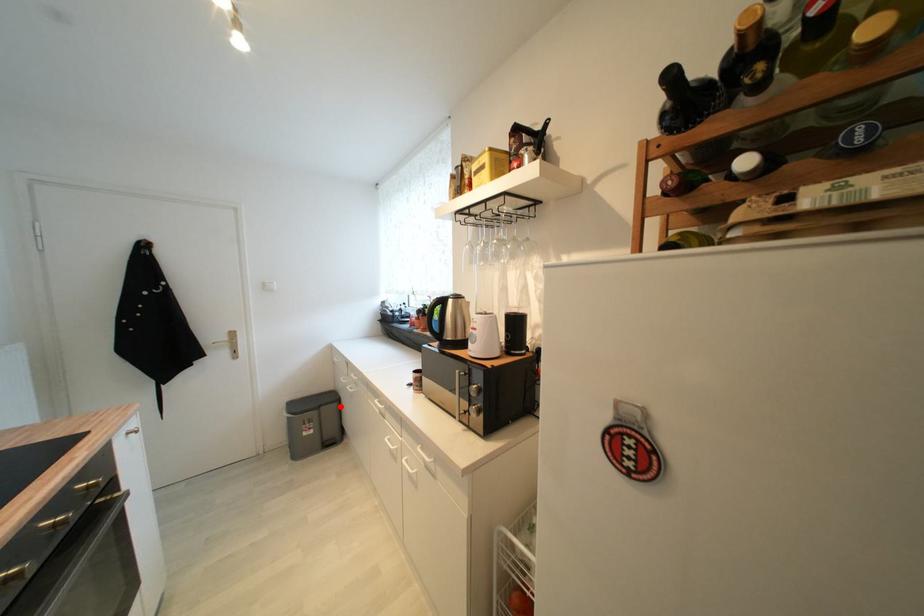
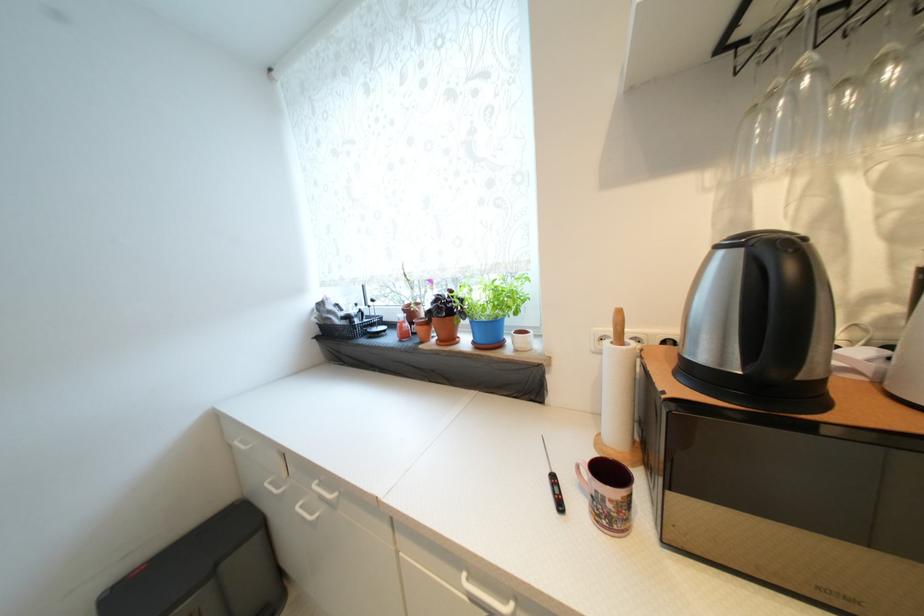
Locate, in the second image, the point that corresponds to the highlighted location in the first image.

(261, 541)